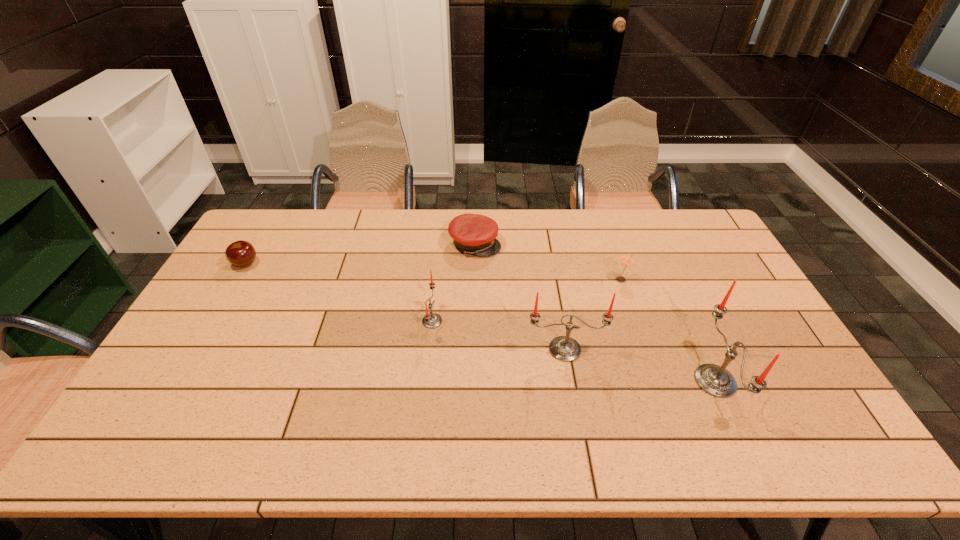
At what (x,y) coordinates should I click in order to perform the action: click on vacant space at the near edge. Please return your answer as a coordinate pair (x, y). Looking at the image, I should click on (678, 395).

In the image, there is a desktop. Identify the location of blank space at the left edge. (245, 299).

This screenshot has height=540, width=960. Identify the location of vacant space at the right edge of the desktop. (788, 361).

The width and height of the screenshot is (960, 540). I want to click on free region at the far left corner of the desktop, so click(x=256, y=242).

You are a GUI agent. You are given a task and a screenshot of the screen. Output one action in this format:
    pyautogui.click(x=<x>, y=<y>)
    Task: Click on the vacant space that's between the fourth object from right to left and the second tallest object
    This screenshot has width=960, height=540.
    Given the screenshot: What is the action you would take?
    pyautogui.click(x=520, y=296)

The width and height of the screenshot is (960, 540). Find the location of `vacant area between the second candle from right to left and the cap`. vacant area between the second candle from right to left and the cap is located at coordinates (520, 296).

Where is `free space between the third object from left to right and the rightmost candle`? Image resolution: width=960 pixels, height=540 pixels. free space between the third object from left to right and the rightmost candle is located at coordinates (595, 313).

Find the location of a particular element. free space between the leftmost object and the third object from right to left is located at coordinates (405, 306).

At what (x,y) coordinates should I click in order to perform the action: click on free space between the fourth object from left to right and the second object from right to left. Please return your answer as a coordinate pair (x, y). This screenshot has width=960, height=540. Looking at the image, I should click on (593, 315).

Where is `free point between the second shortest candle and the fifth object from left to right`? free point between the second shortest candle and the fifth object from left to right is located at coordinates (593, 315).